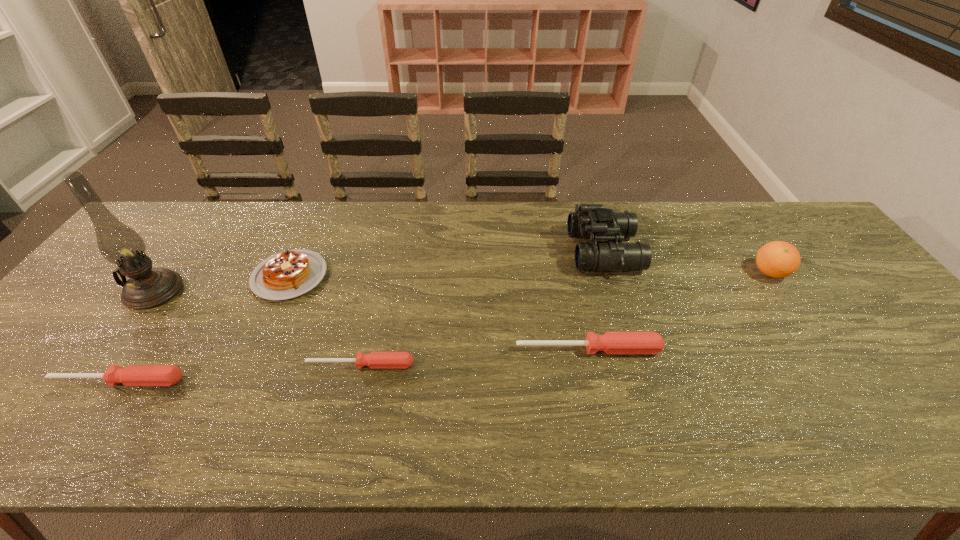
Identify which object is located as the fifth nearest to the second tallest object. Please provide its 2D coordinates. Your answer should be formatted as a tuple, i.e. [(x, y)], where the tuple contains the x and y coordinates of a point satisfying the conditions above.

[(132, 375)]

Select which screwdriver appears as the closest to the third tallest object. Please provide its 2D coordinates. Your answer should be formatted as a tuple, i.e. [(x, y)], where the tuple contains the x and y coordinates of a point satisfying the conditions above.

[(612, 343)]

This screenshot has width=960, height=540. Identify the location of the second closest screwdriver relative to the third object from left to right. (132, 375).

Locate an element on the screen. vacant space that satisfies the following two spatial constraints: 1. on the front side of the oil lamp; 2. on the left side of the fifth farthest object is located at coordinates (111, 349).

Locate an element on the screen. Image resolution: width=960 pixels, height=540 pixels. free space that satisfies the following two spatial constraints: 1. on the back side of the rightmost object; 2. on the left side of the tallest object is located at coordinates (168, 273).

The width and height of the screenshot is (960, 540). I want to click on vacant space that satisfies the following two spatial constraints: 1. on the front side of the tallest object; 2. on the left side of the farthest screwdriver, so click(x=111, y=349).

In order to click on vacant position in the image that satisfies the following two spatial constraints: 1. through the lenses of the binoculars; 2. on the left side of the orange in this screenshot , I will do `click(611, 273)`.

Identify the location of free space that satisfies the following two spatial constraints: 1. on the front side of the tallest object; 2. on the right side of the second tallest screwdriver. (87, 381).